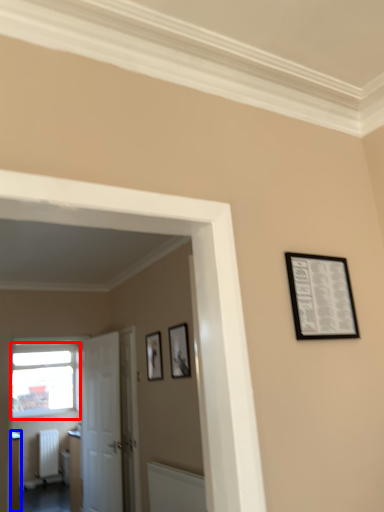
Question: Which point is closer to the camera, window (highlighted by a red box) or furniture (highlighted by a blue box)?

Choices:
 (A) window
 (B) furniture

Answer: (B)